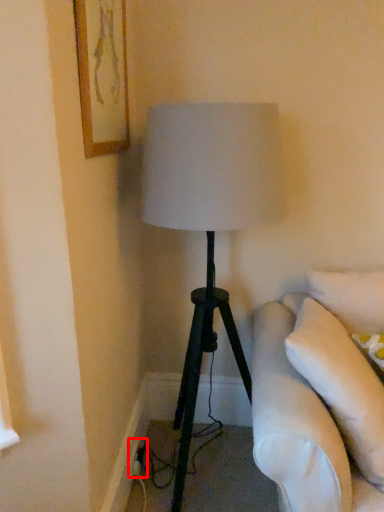
Question: From the image's perspective, considering the relative positions of electric outlet (annotated by the red box) and picture frame in the image provided, where is electric outlet (annotated by the red box) located with respect to the staircase?

Choices:
 (A) below
 (B) above

Answer: (A)